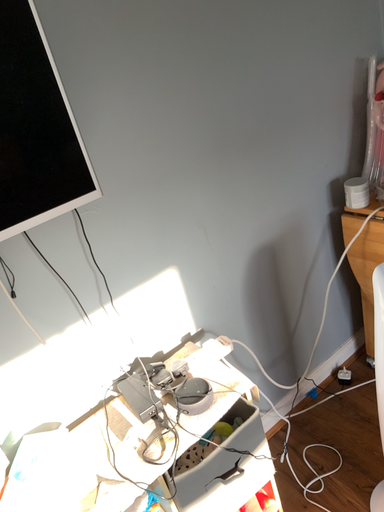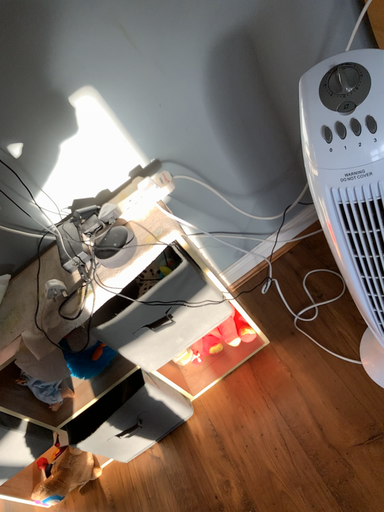
Question: Which way did the camera rotate in the video?

Choices:
 (A) rotated left
 (B) rotated right

Answer: (A)